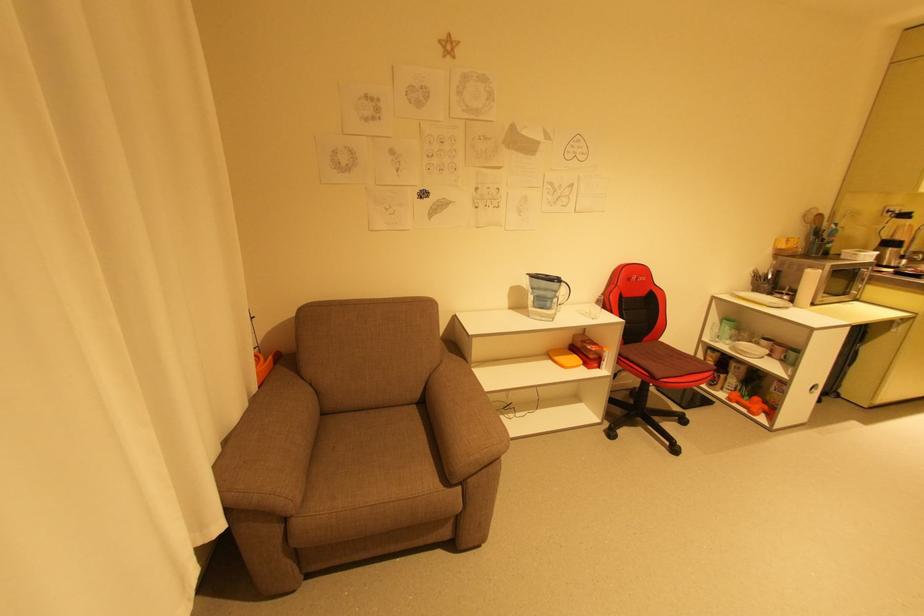
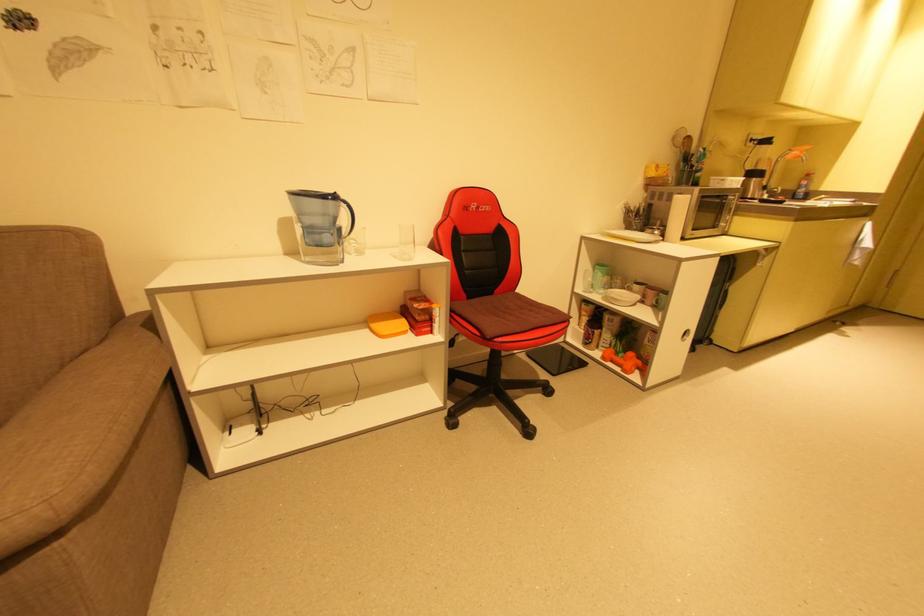
In the second image, find the point that corresponds to the point at 567,284 in the first image.

(346, 204)